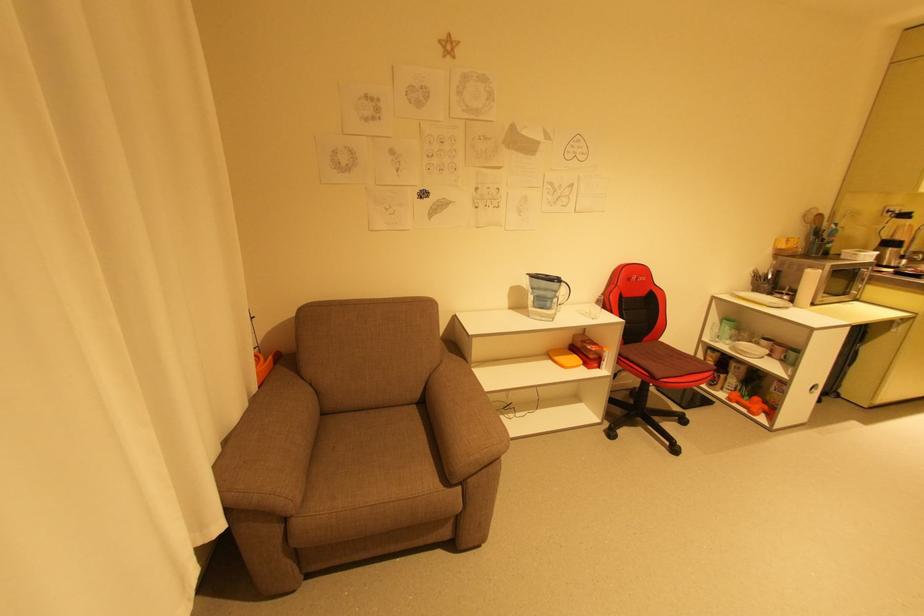
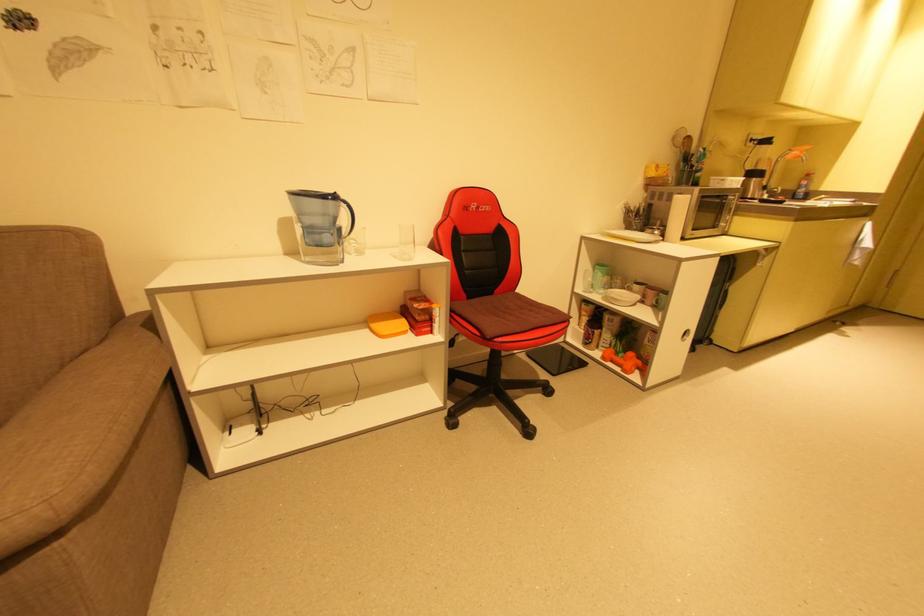
In the second image, find the point that corresponds to the point at 567,284 in the first image.

(346, 204)